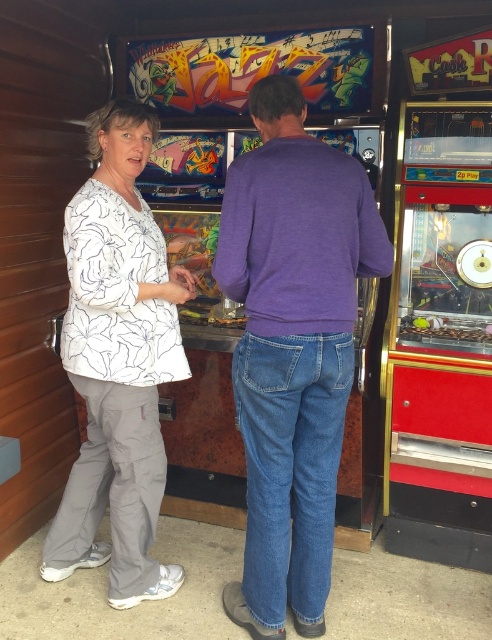
You are trying to decide which clothing item to purchase based on their sizes. The purple cotton sweater at center and the white printed shirt at left are both displayed in the store. Which one has a greater height?

The purple cotton sweater at center is much taller than the white printed shirt at left, so the purple cotton sweater at center has a greater height.

You are standing in front of the arcade machines and want to determine which point is closer to you. The points are labeled as point (236, 412) and point (120, 394). Which point is closer to your position?

Point (120, 394) is closer to you because it is less further to the camera than point (236, 412).